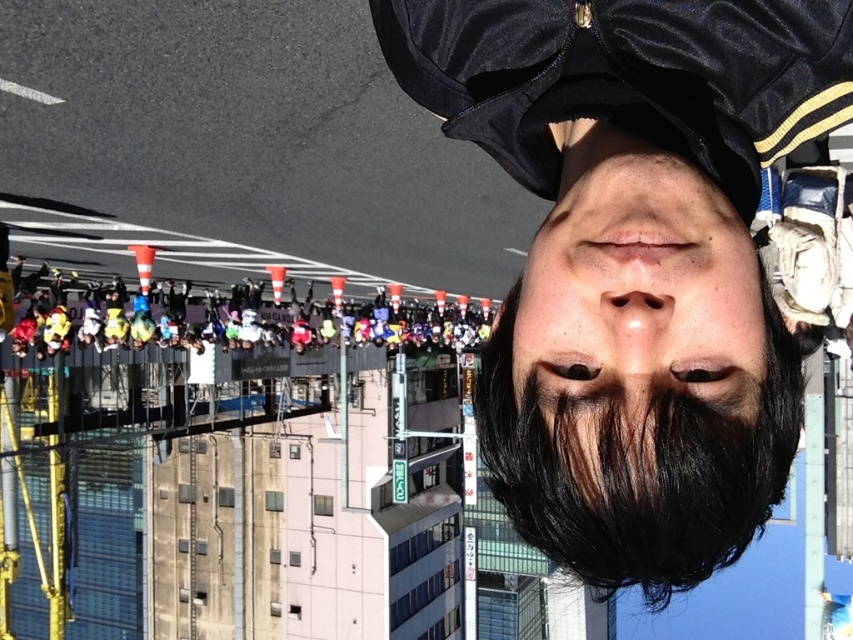
Who is higher up, black satin cap at upper center or dark brown hair at center?

black satin cap at upper center is above.

Find the location of `black satin cap at upper center`. black satin cap at upper center is located at coordinates (633, 257).

Is point (392, 17) farther from viewer compared to point (746, 349)?

Yes.

This screenshot has width=853, height=640. Identify the location of black satin cap at upper center. (633, 257).

Looking at this image, is black satin cap at upper center further to camera compared to black matte beard at center?

No, black satin cap at upper center is in front of black matte beard at center.

Image resolution: width=853 pixels, height=640 pixels. I want to click on black satin cap at upper center, so click(633, 257).

You are a GUI agent. You are given a task and a screenshot of the screen. Output one action in this format:
    pyautogui.click(x=<x>, y=<y>)
    Task: Click on the black satin cap at upper center
    
    Given the screenshot: What is the action you would take?
    pyautogui.click(x=633, y=257)

The image size is (853, 640). In order to click on black satin cap at upper center in this screenshot , I will do `click(633, 257)`.

Between black satin cap at upper center and black matte eye at center, which one appears on the left side from the viewer's perspective?

Positioned to the left is black satin cap at upper center.

Who is more distant from viewer, (685, 84) or (679, 364)?

Point (685, 84)

In order to click on black satin cap at upper center in this screenshot , I will do `click(633, 257)`.